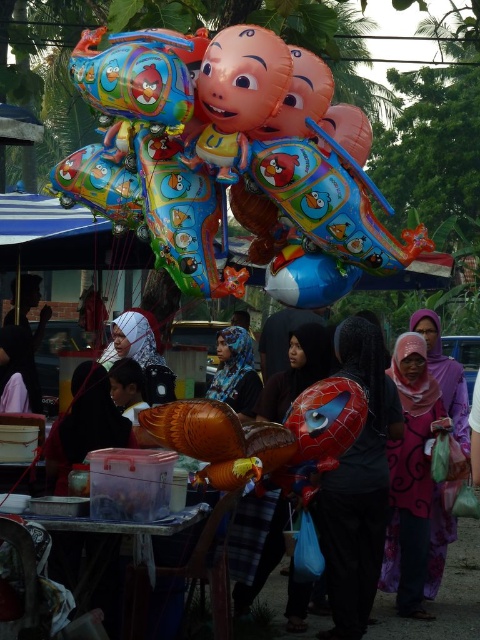
Question: Is multicolored glossy balloons at upper center below purple printed scarf at center?

Choices:
 (A) yes
 (B) no

Answer: (B)

Question: Which object is farther from the camera taking this photo?

Choices:
 (A) purple printed scarf at center
 (B) blue printed scarf at center
 (C) pink satin hijab at center
 (D) multicolored glossy balloons at upper center

Answer: (C)

Question: Which point appears closest to the camera in this image?

Choices:
 (A) (393, 364)
 (B) (360, 576)
 (C) (232, 141)

Answer: (C)

Question: Which object is the closest to the spiderman balloon at center?

Choices:
 (A) purple printed scarf at center
 (B) blue printed scarf at center
 (C) pink satin hijab at center

Answer: (A)

Question: Is spiderman balloon at center thinner than purple printed scarf at center?

Choices:
 (A) yes
 (B) no

Answer: (B)

Question: Can you confirm if multicolored glossy balloons at upper center is bigger than purple printed scarf at center?

Choices:
 (A) yes
 (B) no

Answer: (A)